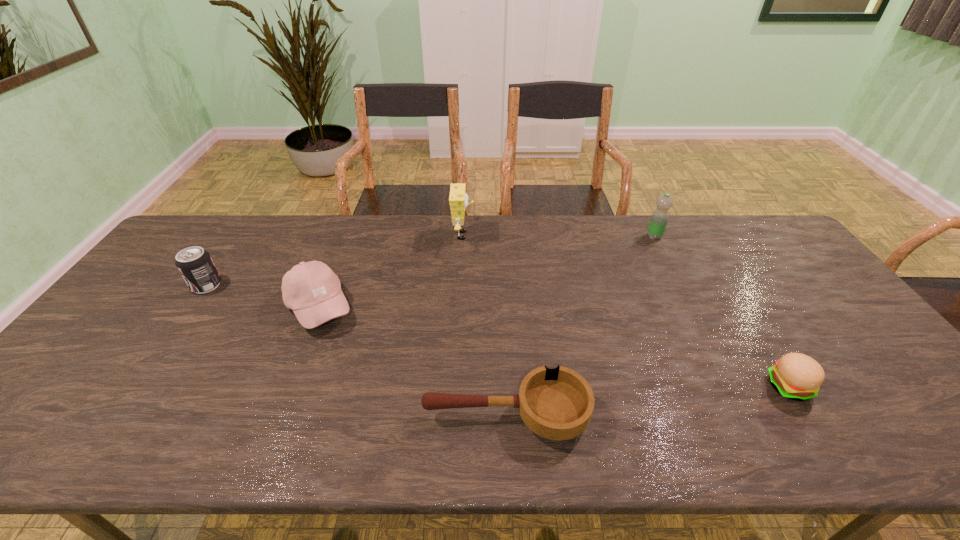
At what (x,y) coordinates should I click in order to perform the action: click on free space at the near left corner of the desktop. Please return your answer as a coordinate pair (x, y). Looking at the image, I should click on (84, 424).

This screenshot has height=540, width=960. What are the coordinates of `free space at the far right corner of the desktop` in the screenshot? It's located at (770, 227).

At what (x,y) coordinates should I click in order to perform the action: click on unoccupied position between the saucepan and the hamburger. Please return your answer as a coordinate pair (x, y). Looking at the image, I should click on (648, 401).

Identify the location of unoccupied position between the sponge and the hamburger. (626, 311).

Where is `free point between the sponge and the saucepan`? free point between the sponge and the saucepan is located at coordinates (485, 325).

Locate an element on the screen. This screenshot has width=960, height=540. empty space between the second object from left to right and the saucepan is located at coordinates (413, 361).

Where is `free spot between the sponge and the leftmost object`? Image resolution: width=960 pixels, height=540 pixels. free spot between the sponge and the leftmost object is located at coordinates (335, 260).

Image resolution: width=960 pixels, height=540 pixels. Identify the location of vacant space that's between the second object from right to left and the hamburger. (722, 312).

Find the location of a particular element. This screenshot has width=960, height=540. vacant area between the sponge and the second object from left to right is located at coordinates (391, 271).

The image size is (960, 540). Identify the location of free point between the baseball cap and the saucepan. (413, 361).